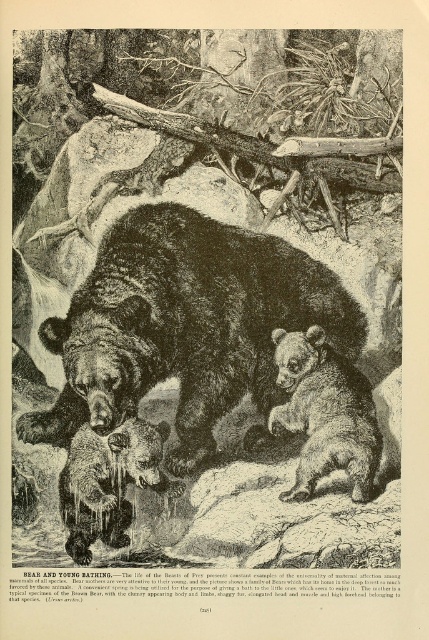
Describe the element at coordinates (325, 413) in the screenshot. The image size is (429, 640). I see `soft brown fur at center` at that location.

The height and width of the screenshot is (640, 429). Identify the location of soft brown fur at center. (325, 413).

Locate an element on the screen. This screenshot has width=429, height=640. soft brown fur at center is located at coordinates 325,413.

Who is positioned more to the right, dark brown fur bear at center or soft brown fur at center?

Positioned to the right is soft brown fur at center.

Between point (99, 300) and point (359, 406), which one is positioned in front?

Point (359, 406) is more forward.

The image size is (429, 640). What are the coordinates of `dark brown fur bear at center` in the screenshot? It's located at (184, 324).

Is dark brown fur bear at center smaller than brown fur cub at lower left?

Incorrect, dark brown fur bear at center is not smaller in size than brown fur cub at lower left.

Is dark brown fur bear at center bigger than brown fur cub at lower left?

Yes, dark brown fur bear at center is bigger than brown fur cub at lower left.

The width and height of the screenshot is (429, 640). Describe the element at coordinates (184, 324) in the screenshot. I see `dark brown fur bear at center` at that location.

Locate an element on the screen. This screenshot has width=429, height=640. dark brown fur bear at center is located at coordinates (184, 324).